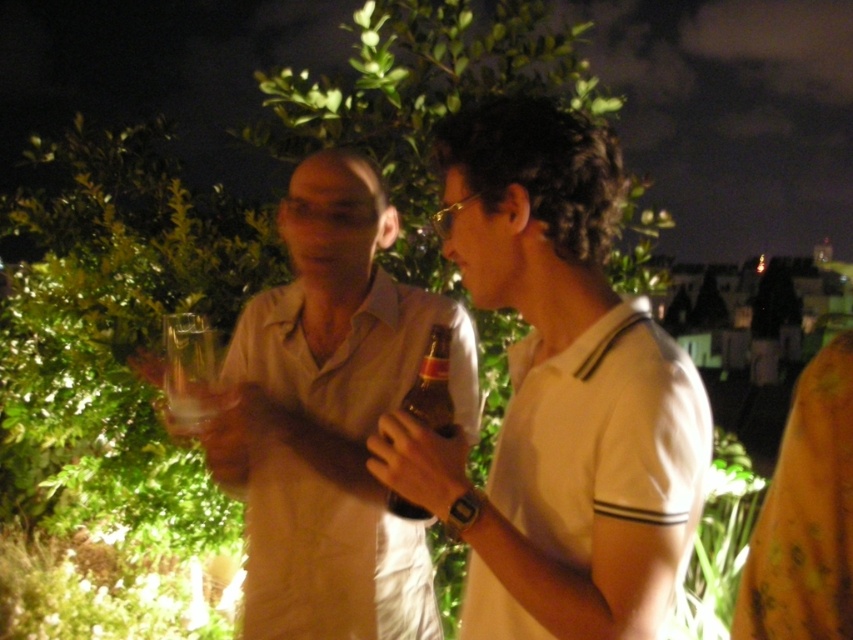
You are at a party and need to grab a drink without spilling it. You see a white cotton shirt at center and a clear glass at center. Which object should you avoid touching to prevent spilling the drink?

You should avoid touching the clear glass at center because the white cotton shirt at center is located above it, meaning the glass is likely holding the drink and touching it might cause a spill.

You are a photographer trying to capture a closeup of the matte beige shirt at center. According to the coordinates provided, where exactly should you position your camera to focus on this object?

The matte beige shirt at center is located at point [329,419], so you should position your camera to focus on that coordinate.